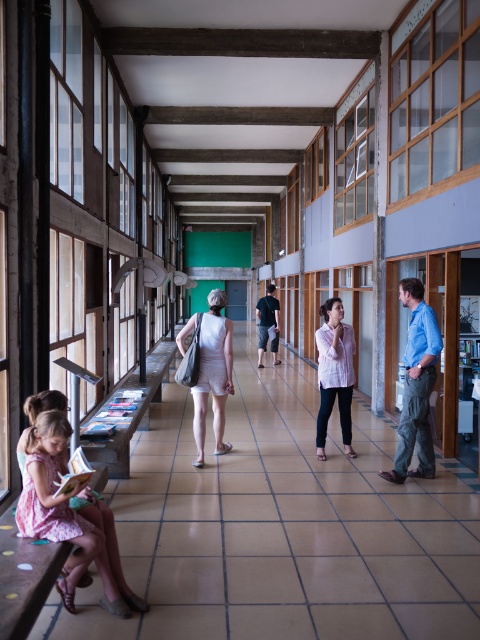
Based on the photo, can you confirm if pink fabric dress at lower left is smaller than dark gray cotton t-shirt at center?

Yes.

Is pink fabric dress at lower left positioned before dark gray cotton t-shirt at center?

Yes, it is.

The image size is (480, 640). Describe the element at coordinates (55, 502) in the screenshot. I see `pink fabric dress at lower left` at that location.

You are a GUI agent. You are given a task and a screenshot of the screen. Output one action in this format:
    pyautogui.click(x=<x>, y=<y>)
    Task: Click on the pink fabric dress at lower left
    
    Given the screenshot: What is the action you would take?
    pyautogui.click(x=55, y=502)

The height and width of the screenshot is (640, 480). Describe the element at coordinates (55, 502) in the screenshot. I see `pink fabric dress at lower left` at that location.

Does pink fabric dress at lower left appear over blue cotton shirt at right?

Incorrect, pink fabric dress at lower left is not positioned above blue cotton shirt at right.

What do you see at coordinates (55, 502) in the screenshot? I see `pink fabric dress at lower left` at bounding box center [55, 502].

Where is `pink fabric dress at lower left`? pink fabric dress at lower left is located at coordinates (55, 502).

Is blue cotton shirt at right in front of white cotton dress at center?

Yes.

Does blue cotton shirt at right appear on the right side of white cotton dress at center?

Correct, you'll find blue cotton shirt at right to the right of white cotton dress at center.

Is point (405, 436) closer to viewer compared to point (222, 449)?

Yes, point (405, 436) is closer to viewer.

What are the coordinates of `blue cotton shirt at right` in the screenshot? It's located at (417, 385).